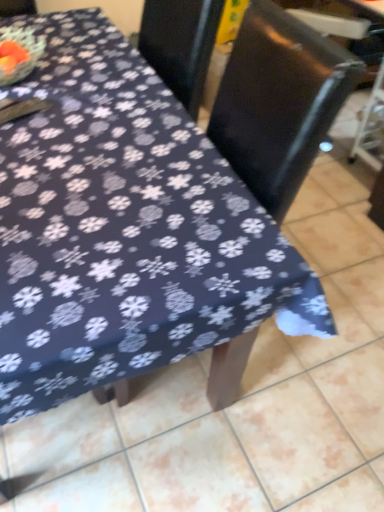
Measure the distance between point (294, 196) and camera.

Point (294, 196) and camera are 6.82 feet apart.

The image size is (384, 512). Describe the element at coordinates (278, 102) in the screenshot. I see `black glossy chair at upper center` at that location.

Where is `black glossy chair at upper center`? This screenshot has width=384, height=512. black glossy chair at upper center is located at coordinates (278, 102).

Image resolution: width=384 pixels, height=512 pixels. Describe the element at coordinates (278, 102) in the screenshot. I see `black plastic swivel chair at right` at that location.

Image resolution: width=384 pixels, height=512 pixels. What are the coordinates of `black plastic swivel chair at right` in the screenshot? It's located at (278, 102).

Where is `black glossy chair at upper center`? This screenshot has height=512, width=384. black glossy chair at upper center is located at coordinates (278, 102).

Which is more to the left, black glossy chair at upper center or black plastic swivel chair at right?

black glossy chair at upper center is more to the left.

Is black glossy chair at upper center positioned in front of black plastic swivel chair at right?

Yes, black glossy chair at upper center is closer to the viewer.

Considering the points (252, 123) and (310, 146), which point is in front, point (252, 123) or point (310, 146)?

The point (310, 146) is closer to the camera.

From the image's perspective, which object appears higher, black glossy chair at upper center or black plastic swivel chair at right?

black plastic swivel chair at right.

From a real-world perspective, is black glossy chair at upper center physically located above or below black plastic swivel chair at right?

In terms of real-world spatial position, black glossy chair at upper center is above black plastic swivel chair at right.

From the picture: Between black glossy chair at upper center and black plastic swivel chair at right, which one has smaller width?

black glossy chair at upper center.

Which of these two, black glossy chair at upper center or black plastic swivel chair at right, stands shorter?

Standing shorter between the two is black plastic swivel chair at right.

Can you confirm if black glossy chair at upper center is bigger than black plastic swivel chair at right?

No, black glossy chair at upper center is not bigger than black plastic swivel chair at right.

Do you think black glossy chair at upper center is within black plastic swivel chair at right, or outside of it?

black glossy chair at upper center is not enclosed by black plastic swivel chair at right.

Is black glossy chair at upper center positioned far away from black plastic swivel chair at right?

No.

Is black glossy chair at upper center positioned with its back to black plastic swivel chair at right?

black glossy chair at upper center is not turned away from black plastic swivel chair at right.

How different are the orientations of black glossy chair at upper center and black plastic swivel chair at right in degrees?

They differ by 1.04 degrees in their facing directions.

Find the location of a particular element. chair that is above the black plastic swivel chair at right (from a real-world perspective) is located at coordinates (278, 102).

Can you confirm if black plastic swivel chair at right is positioned to the left of black glossy chair at upper center?

No.

Which object is more forward, black plastic swivel chair at right or black glossy chair at upper center?

black glossy chair at upper center is more forward.

Which point is more forward, (234,141) or (240,145)?

The point (240,145) is more forward.

From the image's perspective, is black plastic swivel chair at right under black glossy chair at upper center?

No.

From a real-world perspective, which is physically below, black plastic swivel chair at right or black glossy chair at upper center?

In real-world perspective, black plastic swivel chair at right is lower.

Looking at this image, which object is wider, black plastic swivel chair at right or black glossy chair at upper center?

With larger width is black plastic swivel chair at right.

Considering the sizes of objects black plastic swivel chair at right and black glossy chair at upper center in the image provided, who is shorter, black plastic swivel chair at right or black glossy chair at upper center?

Standing shorter between the two is black plastic swivel chair at right.

In terms of size, does black plastic swivel chair at right appear bigger or smaller than black glossy chair at upper center?

Considering their sizes, black plastic swivel chair at right takes up more space than black glossy chair at upper center.

Is black plastic swivel chair at right completely or partially outside of black glossy chair at upper center?

Yes.

Are black plastic swivel chair at right and black glossy chair at upper center far apart?

That's not correct — black plastic swivel chair at right is a little close to black glossy chair at upper center.

Is black plastic swivel chair at right looking in the opposite direction of black glossy chair at upper center?

No, black plastic swivel chair at right is not facing away from black glossy chair at upper center.

Identify the location of swivel chair located above the black glossy chair at upper center (from the image's perspective). (278, 102).

The image size is (384, 512). In order to click on swivel chair directly beneath the black glossy chair at upper center (from a real-world perspective) in this screenshot , I will do `click(278, 102)`.

Where is `chair above the black plastic swivel chair at right (from a real-world perspective)`? This screenshot has width=384, height=512. chair above the black plastic swivel chair at right (from a real-world perspective) is located at coordinates (278, 102).